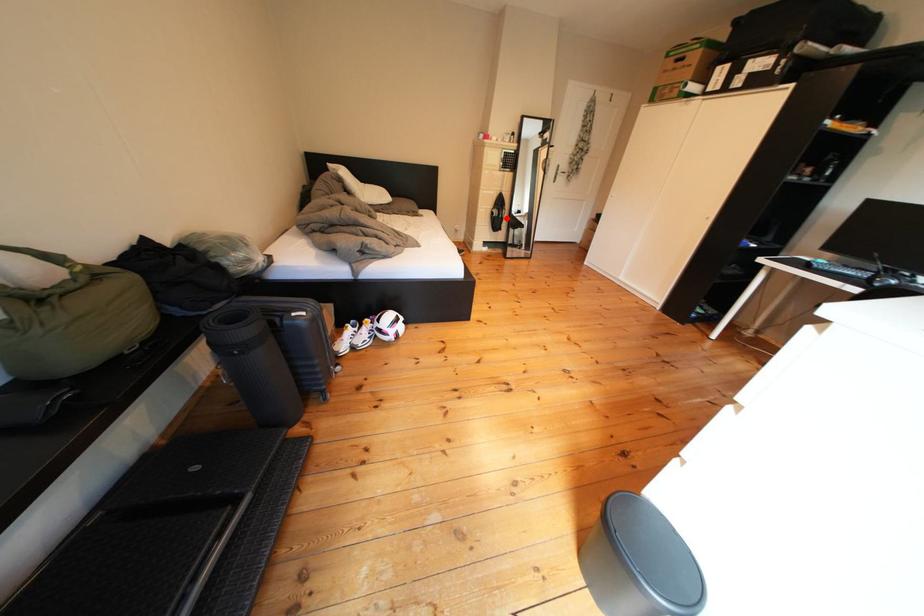
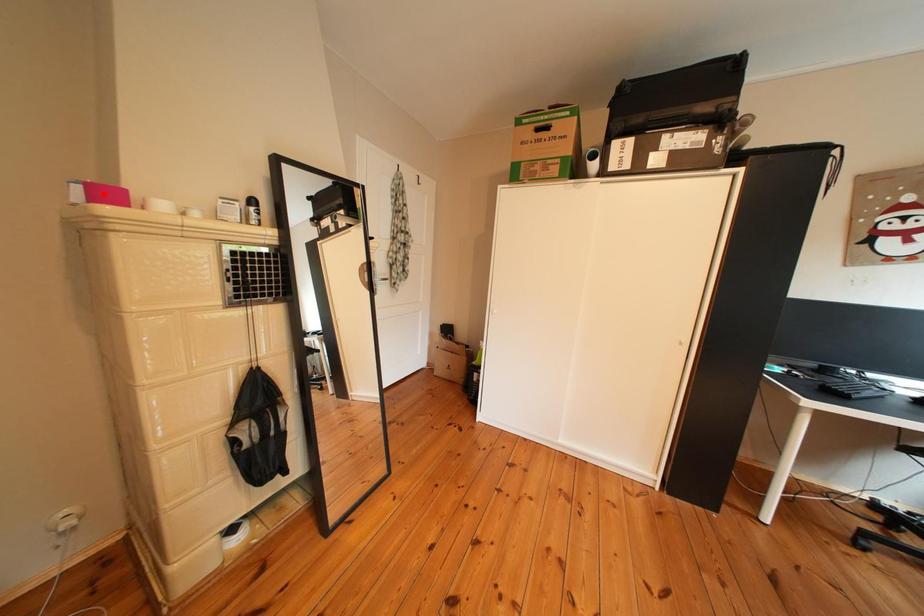
I am providing you with two images of the same scene from different viewpoints. A red point is marked on the first image and another point is marked on the second image. Does the point marked in image1 correspond to the same location as the one in image2?

No